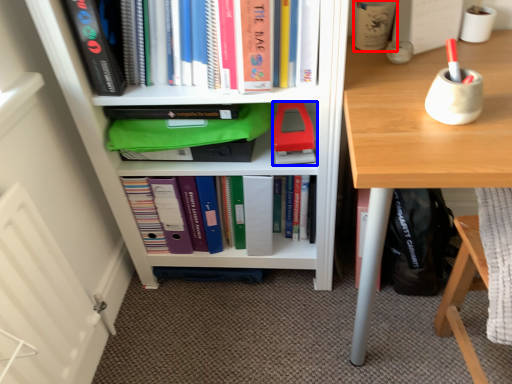
Question: Which point is further to the camera, stationery (highlighted by a red box) or paperback book (highlighted by a blue box)?

Choices:
 (A) stationery
 (B) paperback book

Answer: (B)